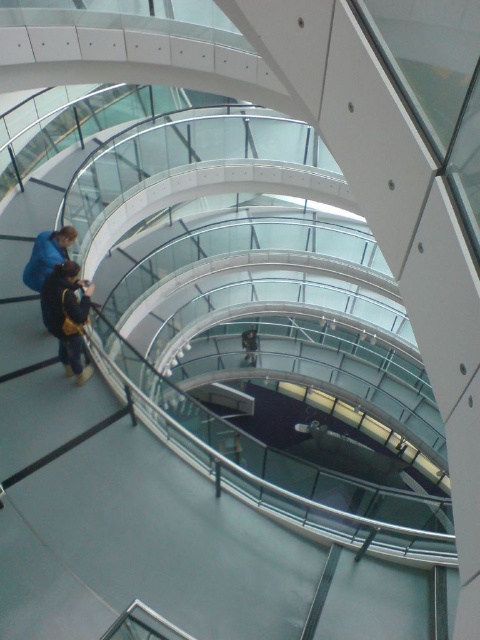
What do you see at coordinates (68, 316) in the screenshot?
I see `dark brown leather jacket at lower left` at bounding box center [68, 316].

Where is `dark brown leather jacket at lower left`? This screenshot has width=480, height=640. dark brown leather jacket at lower left is located at coordinates (68, 316).